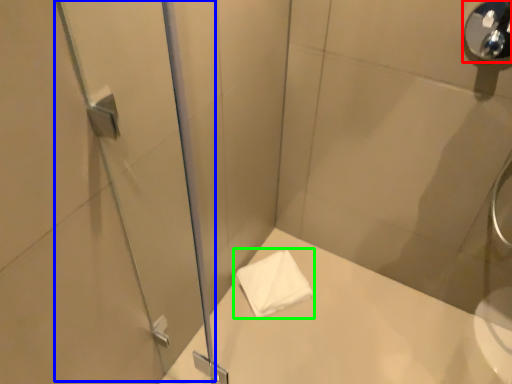
Question: Which object is positioned closest to shower (highlighted by a red box)? Select from screen door (highlighted by a blue box) and towel (highlighted by a green box).

Choices:
 (A) screen door
 (B) towel

Answer: (A)